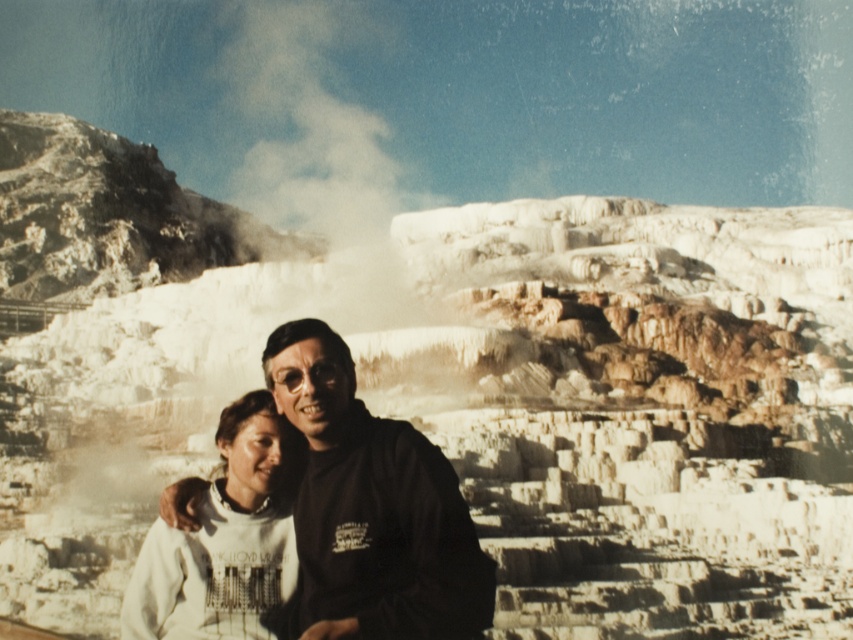
You are a photographer trying to capture both the white matte sweatshirt at center and the white fleece sweatshirt at center in a single shot. Since they are both at the center, how can you adjust your camera angle to ensure both are clearly visible?

Since the white matte sweatshirt at center is larger in size than the white fleece sweatshirt at center, you can zoom out slightly to include more of the background, allowing both sweatshirts to be visible without one overpowering the other.

Based on the photo, you are a photographer trying to capture the two people in the scene. The subjects are wearing a white matte sweatshirt at center and a white fleece sweatshirt at center. Which one is on the right side when viewed from the photographer perspective?

The white matte sweatshirt at center is positioned on the right side of the white fleece sweatshirt at center.